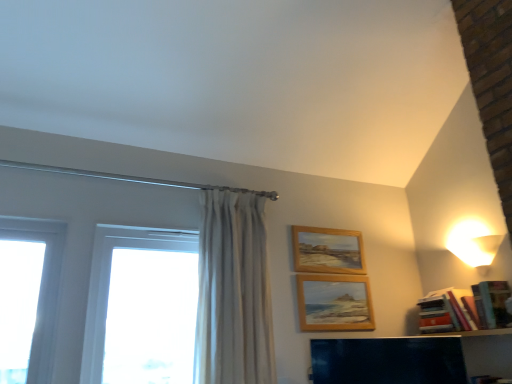
Question: Does hardcover books at right come behind wooden shelf at lower right?

Choices:
 (A) no
 (B) yes

Answer: (B)

Question: Considering the relative positions of hardcover books at right and wooden shelf at lower right in the image provided, is hardcover books at right to the right of wooden shelf at lower right from the viewer's perspective?

Choices:
 (A) yes
 (B) no

Answer: (A)

Question: Is wooden shelf at lower right a part of hardcover books at right?

Choices:
 (A) yes
 (B) no

Answer: (B)

Question: Does hardcover books at right touch wooden shelf at lower right?

Choices:
 (A) yes
 (B) no

Answer: (B)

Question: Is hardcover books at right outside wooden shelf at lower right?

Choices:
 (A) yes
 (B) no

Answer: (A)

Question: Does point (453, 228) appear closer or farther from the camera than point (353, 360)?

Choices:
 (A) closer
 (B) farther

Answer: (B)

Question: Based on their sizes in the image, would you say white glossy lampshade at upper right is bigger or smaller than wooden shelf at lower right?

Choices:
 (A) big
 (B) small

Answer: (B)

Question: Is white glossy lampshade at upper right spatially inside wooden shelf at lower right, or outside of it?

Choices:
 (A) inside
 (B) outside

Answer: (B)

Question: Considering their positions, is white glossy lampshade at upper right located in front of or behind wooden shelf at lower right?

Choices:
 (A) behind
 (B) front

Answer: (A)

Question: From a real-world perspective, is white glass window at left positioned above or below wooden picture frame at center, which ranks as the 1th picture frame in bottom-to-top order?

Choices:
 (A) above
 (B) below

Answer: (B)

Question: From the image's perspective, relative to wooden picture frame at center, which appears as the 2th picture frame when viewed from the top, is white glass window at left above or below?

Choices:
 (A) above
 (B) below

Answer: (A)

Question: In the image, is white glass window at left positioned in front of or behind wooden picture frame at center, which appears as the 2th picture frame when viewed from the top?

Choices:
 (A) front
 (B) behind

Answer: (A)

Question: In the image, is white glass window at left on the left side or the right side of wooden picture frame at center, which appears as the 2th picture frame when viewed from the top?

Choices:
 (A) right
 (B) left

Answer: (B)

Question: Is wooden picture frame at center, which appears as the 2th picture frame when viewed from the top, taller or shorter than white glass window at left?

Choices:
 (A) short
 (B) tall

Answer: (A)

Question: Is wooden picture frame at center, which ranks as the 1th picture frame in bottom-to-top order, wider or thinner than white glass window at left?

Choices:
 (A) thin
 (B) wide

Answer: (A)